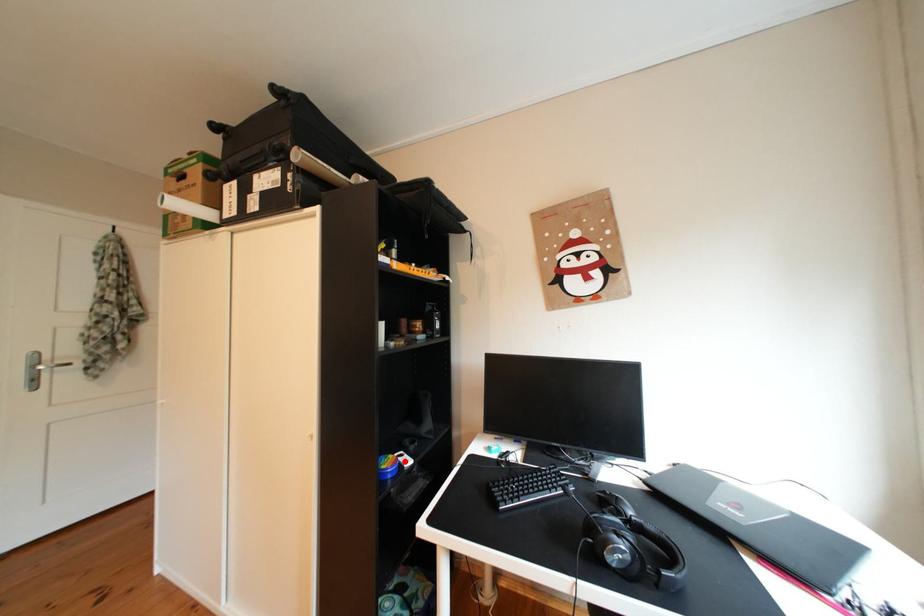
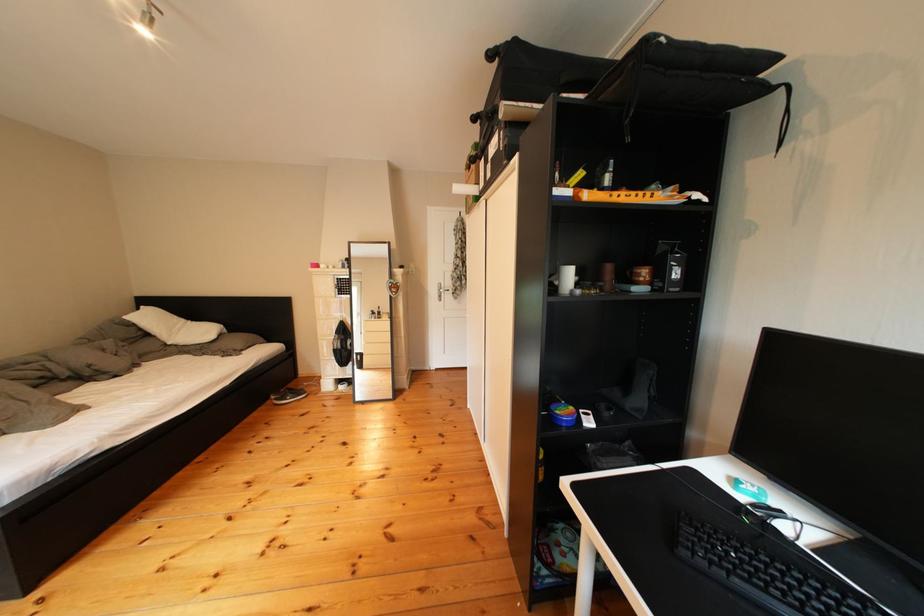
In the second image, find the point that corresponds to the highlighted location in the first image.

(586, 413)